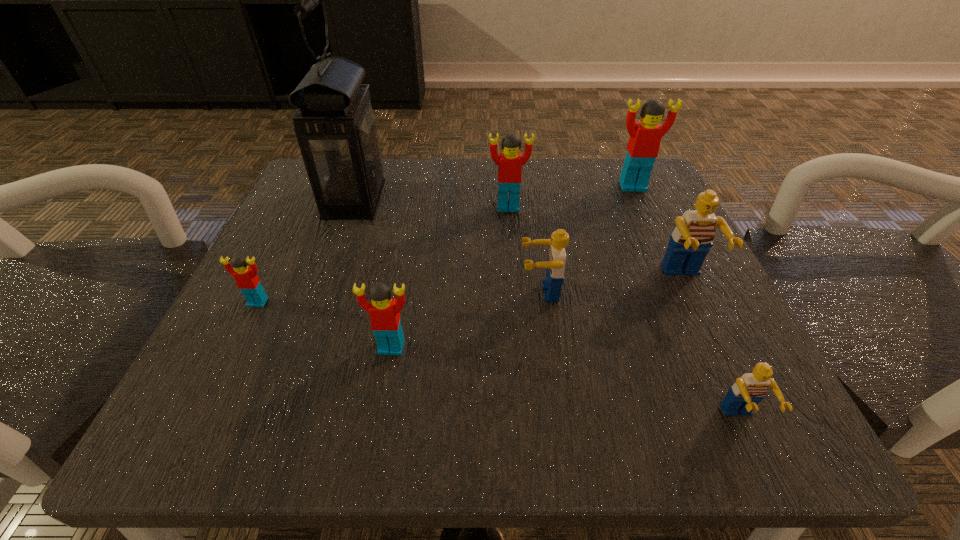
Where is `gray lantern`? This screenshot has height=540, width=960. gray lantern is located at coordinates (336, 129).

I want to click on lantern, so click(x=336, y=129).

Find the location of a particular element. Image resolution: width=960 pixels, height=540 pixels. the biggest red Lego is located at coordinates (645, 136).

Where is `the rightmost red Lego`? the rightmost red Lego is located at coordinates (645, 136).

Identify the location of the sixth nearest Lego. Image resolution: width=960 pixels, height=540 pixels. (510, 162).

The height and width of the screenshot is (540, 960). In order to click on the third red Lego from left to right in this screenshot , I will do `click(510, 162)`.

Image resolution: width=960 pixels, height=540 pixels. Find the location of `the biggest blue Lego`. the biggest blue Lego is located at coordinates (691, 240).

I want to click on the nearest red Lego, so click(384, 311).

In order to click on the second smallest red Lego in this screenshot , I will do `click(384, 311)`.

Find the location of a particular element. This screenshot has width=960, height=540. the second biggest blue Lego is located at coordinates (555, 264).